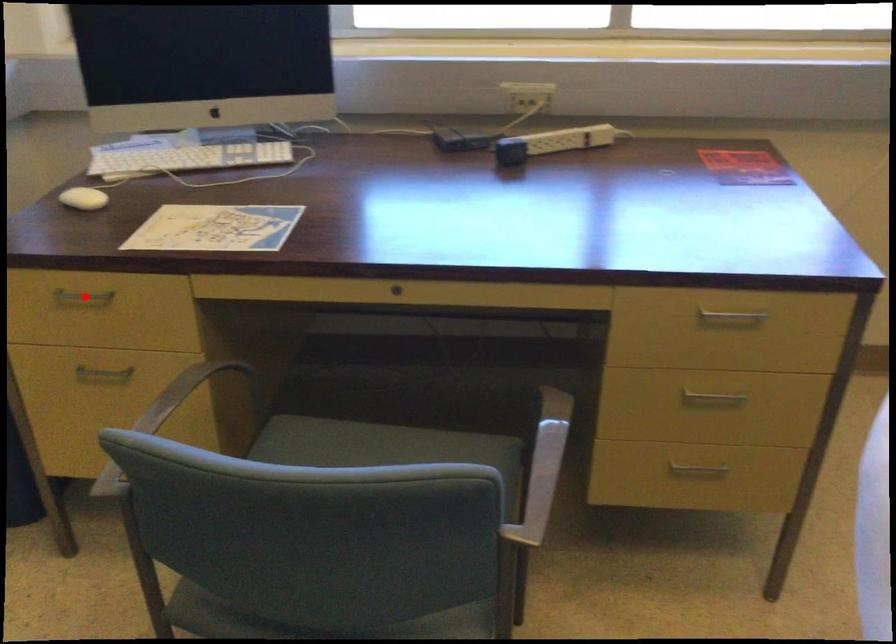
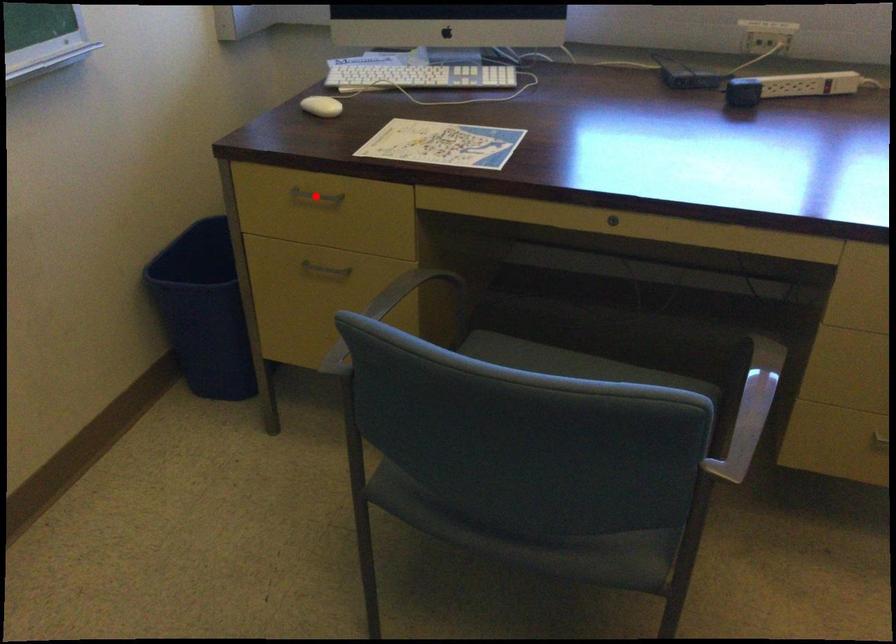
I am providing you with two images of the same scene from different viewpoints. A red point is marked on the first image and another point is marked on the second image. Does the point marked in image1 correspond to the same location as the one in image2?

Yes